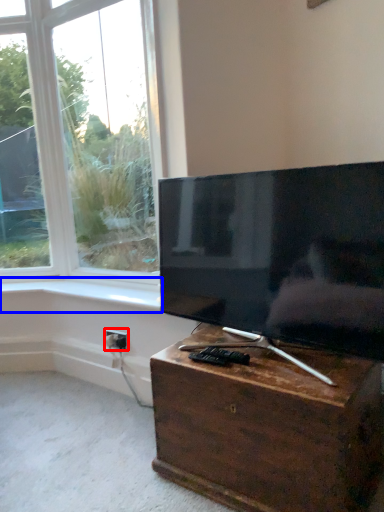
Question: Which of the following is the farthest to the observer, electric outlet (highlighted by a red box) or window sill (highlighted by a blue box)?

Choices:
 (A) electric outlet
 (B) window sill

Answer: (A)